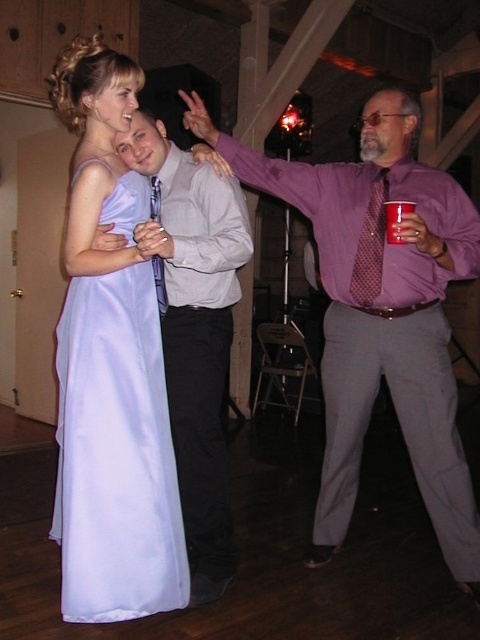
Question: Which is farther from the matte blue tie at center?

Choices:
 (A) white paper cup at center
 (B) polka dot silk tie at right
 (C) matte gray shirt at center
 (D) satin white dress at left

Answer: (A)

Question: Observing the image, what is the correct spatial positioning of matte blue tie at center in reference to white paper cup at center?

Choices:
 (A) below
 (B) above

Answer: (A)

Question: Among these points, which one is nearest to the camera?

Choices:
 (A) pyautogui.click(x=157, y=209)
 (B) pyautogui.click(x=387, y=179)
 (C) pyautogui.click(x=187, y=337)
 (D) pyautogui.click(x=142, y=563)

Answer: (D)

Question: Can you confirm if satin white dress at left is thinner than polka dot silk tie at right?

Choices:
 (A) no
 (B) yes

Answer: (A)

Question: Can you confirm if polka dot silk tie at right is positioned below matte blue tie at center?

Choices:
 (A) yes
 (B) no

Answer: (B)

Question: Which object is the farthest from the matte blue tie at center?

Choices:
 (A) matte gray shirt at center
 (B) white paper cup at center
 (C) polka dot silk tie at right

Answer: (B)